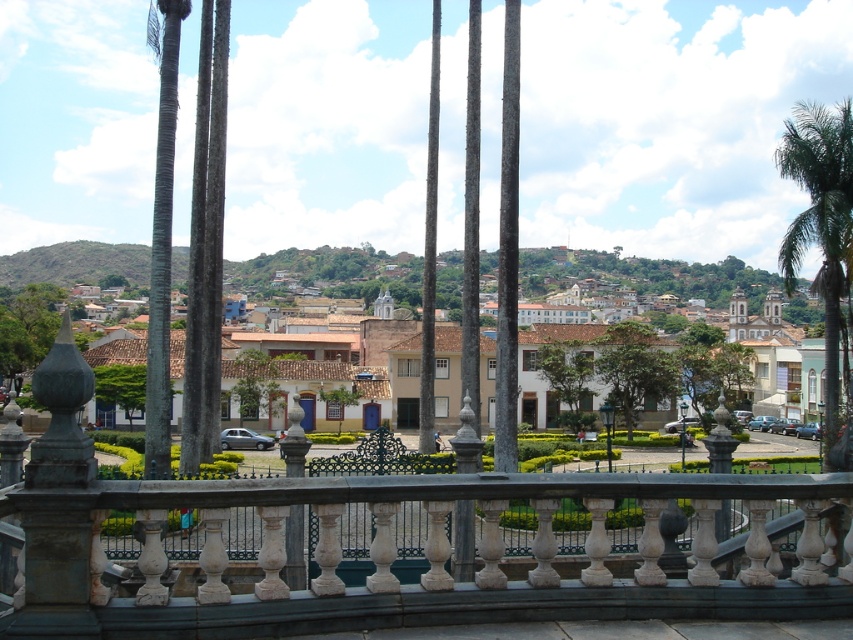
Can you confirm if stone balustrade at center is wider than green leafy tree at center?

Yes, stone balustrade at center is wider than green leafy tree at center.

Can you confirm if stone balustrade at center is positioned above green leafy tree at center?

No, stone balustrade at center is not above green leafy tree at center.

Is point (605, 500) less distant than point (646, 381)?

Yes, point (605, 500) is closer to viewer.

Where is `stone balustrade at center`? stone balustrade at center is located at coordinates [425, 556].

Which is more to the left, white matte building at center or green leafy tree at center?

white matte building at center

Does white matte building at center come in front of green leafy tree at center?

No, it is behind green leafy tree at center.

Where is `white matte building at center`? The image size is (853, 640). white matte building at center is located at coordinates (660, 273).

Is green leafy palm tree at right wider than green leafy tree at center?

Correct, the width of green leafy palm tree at right exceeds that of green leafy tree at center.

Is point (793, 125) closer to camera compared to point (621, 376)?

That is True.

Where is `green leafy palm tree at right`? The width and height of the screenshot is (853, 640). green leafy palm tree at right is located at coordinates [x=822, y=241].